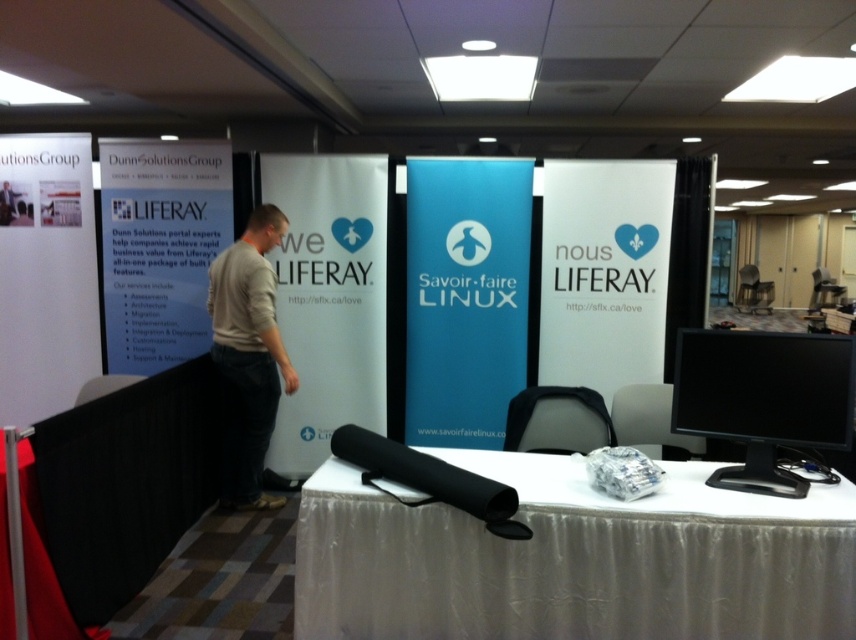
Question: Among these points, which one is nearest to the camera?

Choices:
 (A) (120, 250)
 (B) (452, 252)

Answer: (B)

Question: Which object is positioned closest to the gray cotton shirt at center?

Choices:
 (A) white fabric banner at center
 (B) white fabric table at center
 (C) blue fabric banner at center

Answer: (A)

Question: Is white fabric banner at center positioned in front of gray cotton shirt at center?

Choices:
 (A) yes
 (B) no

Answer: (B)

Question: Which object is farther from the camera taking this photo?

Choices:
 (A) white fabric table at center
 (B) white paper at upper left
 (C) gray cotton shirt at center
 (D) blue fabric banner at center

Answer: (B)

Question: Is white paperboard sign at center below white paper at upper left?

Choices:
 (A) no
 (B) yes

Answer: (B)

Question: Is white paperboard sign at center closer to the viewer compared to gray cotton shirt at center?

Choices:
 (A) yes
 (B) no

Answer: (B)